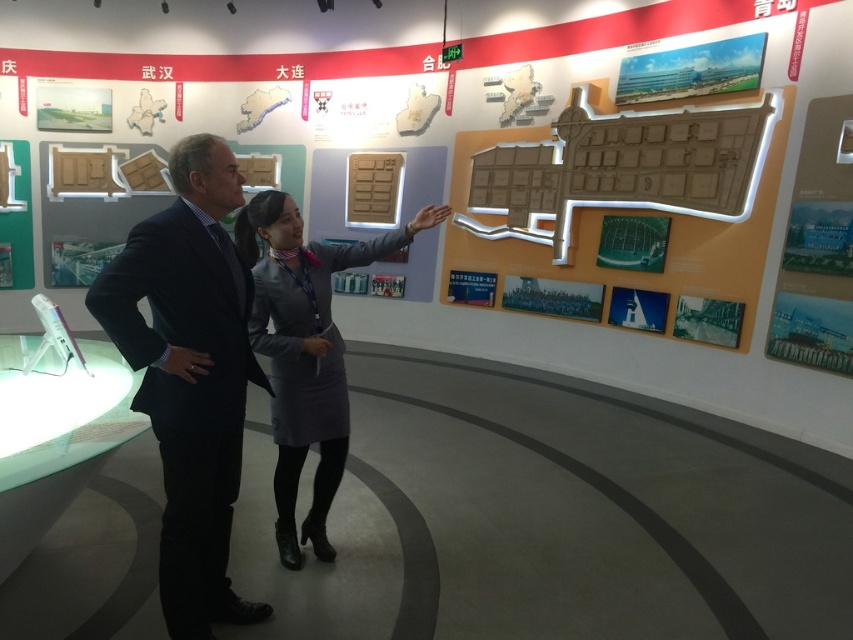
Question: Which of the following is the farthest from the observer?

Choices:
 (A) (100, 305)
 (B) (293, 440)

Answer: (B)

Question: Is dark blue suit at center above gray fabric dress at center?

Choices:
 (A) no
 (B) yes

Answer: (B)

Question: Can you confirm if dark blue suit at center is bigger than gray fabric dress at center?

Choices:
 (A) no
 (B) yes

Answer: (A)

Question: Which point appears farthest from the camera in this image?

Choices:
 (A) (296, 440)
 (B) (173, 275)

Answer: (A)

Question: Which point is farther to the camera?

Choices:
 (A) [x=223, y=232]
 (B) [x=277, y=337]

Answer: (B)

Question: Is dark blue suit at center below gray fabric dress at center?

Choices:
 (A) yes
 (B) no

Answer: (B)